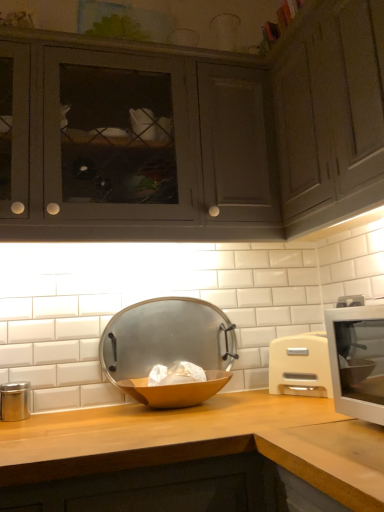
Question: Considering the relative positions of metallic silver bowl at center and white plastic microwave at right in the image provided, is metallic silver bowl at center to the left or to the right of white plastic microwave at right?

Choices:
 (A) left
 (B) right

Answer: (A)

Question: Looking at the image, does metallic silver bowl at center seem bigger or smaller compared to white plastic microwave at right?

Choices:
 (A) big
 (B) small

Answer: (A)

Question: Estimate the real-world distances between objects in this image. Which object is farther from the white plastic microwave at right?

Choices:
 (A) wooden at center
 (B) matte gray cabinet at upper right, which is the second cabinetry in left-to-right order
 (C) metallic silver bowl at center
 (D) matte gray cabinets at upper left, which ranks as the 1th cabinetry in left-to-right order
 (E) wooden bowl at center

Answer: (D)

Question: Considering the real-world distances, which object is farthest from the white plastic microwave at right?

Choices:
 (A) matte gray cabinet at upper right, which is the second cabinetry in left-to-right order
 (B) metallic silver bowl at center
 (C) matte gray cabinets at upper left, the 2th cabinetry viewed from the right
 (D) wooden bowl at center
 (E) white plastic microwave at right

Answer: (C)